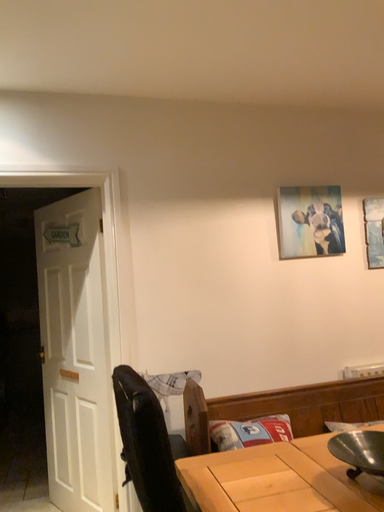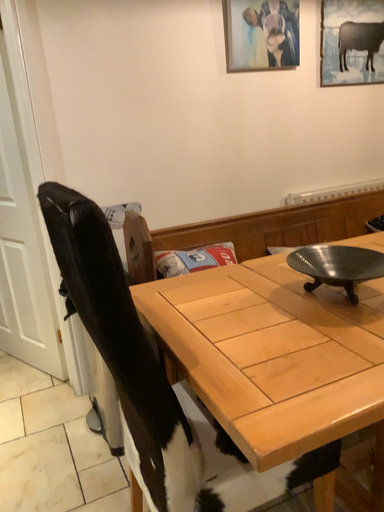
Question: Which way did the camera rotate in the video?

Choices:
 (A) rotated right
 (B) rotated left

Answer: (A)